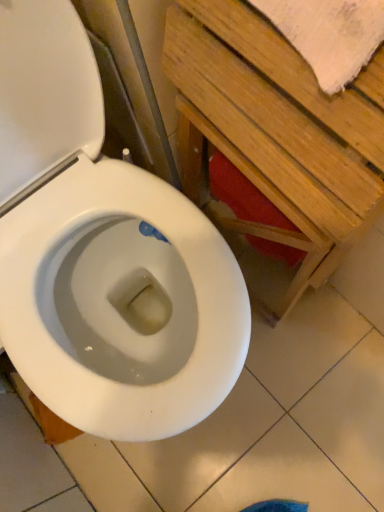
What do you see at coordinates (277, 133) in the screenshot?
I see `wooden bench at upper right` at bounding box center [277, 133].

The image size is (384, 512). In order to click on wooden bench at upper right in this screenshot , I will do `click(277, 133)`.

At what (x,y) coordinates should I click in order to perform the action: click on wooden bench at upper right. Please return your answer as a coordinate pair (x, y). This screenshot has width=384, height=512. Looking at the image, I should click on (277, 133).